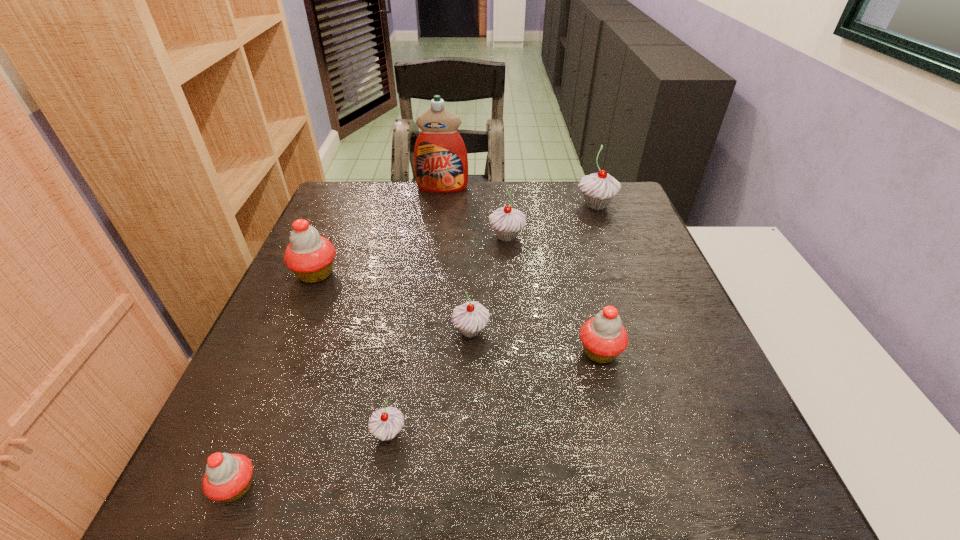
The image size is (960, 540). In order to click on the second biggest red cupcake in this screenshot , I will do `click(604, 337)`.

The height and width of the screenshot is (540, 960). Find the location of `the rightmost red cupcake`. the rightmost red cupcake is located at coordinates (604, 337).

Locate an element on the screen. This screenshot has width=960, height=540. the sixth farthest cupcake is located at coordinates (385, 423).

This screenshot has height=540, width=960. Identify the location of the third cupcake from left to right. pos(385,423).

Locate an element on the screen. This screenshot has height=540, width=960. the nearest object is located at coordinates (228, 477).

Identify the location of the nearest red cupcake. (228, 477).

You are a GUI agent. You are given a task and a screenshot of the screen. Output one action in this format:
    pyautogui.click(x=<x>, y=<y>)
    Task: Click on the vacant position located 0.160m on the front surface of the tallest object
    
    Given the screenshot: What is the action you would take?
    pyautogui.click(x=438, y=224)

The height and width of the screenshot is (540, 960). I want to click on vacant region located 0.260m on the front of the second farthest object, so click(x=622, y=276).

I want to click on free spot located 0.280m on the left of the third gray cupcake from left to right, so click(x=383, y=237).

Find the location of a particular element. vacant point located on the front of the fifth nearest object is located at coordinates (266, 389).